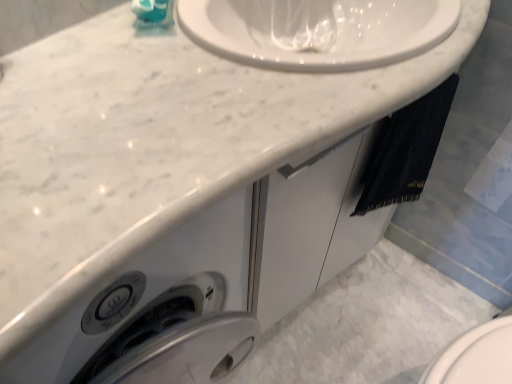
Question: In the image, is black denim towel at right on the left side or the right side of teal glossy soap dispenser at upper left?

Choices:
 (A) right
 (B) left

Answer: (A)

Question: Looking at their shapes, would you say black denim towel at right is wider or thinner than teal glossy soap dispenser at upper left?

Choices:
 (A) wide
 (B) thin

Answer: (B)

Question: From the image's perspective, is black denim towel at right above or below teal glossy soap dispenser at upper left?

Choices:
 (A) below
 (B) above

Answer: (A)

Question: Is teal glossy soap dispenser at upper left spatially inside black denim towel at right, or outside of it?

Choices:
 (A) outside
 (B) inside

Answer: (A)

Question: Considering the positions of teal glossy soap dispenser at upper left and black denim towel at right in the image, is teal glossy soap dispenser at upper left wider or thinner than black denim towel at right?

Choices:
 (A) thin
 (B) wide

Answer: (B)

Question: Looking at the image, does teal glossy soap dispenser at upper left seem bigger or smaller compared to black denim towel at right?

Choices:
 (A) small
 (B) big

Answer: (A)

Question: In the image, is teal glossy soap dispenser at upper left on the left side or the right side of black denim towel at right?

Choices:
 (A) left
 (B) right

Answer: (A)